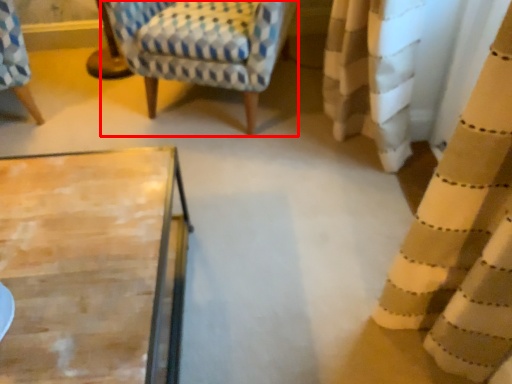
Question: From the image's perspective, where is rocking chair (annotated by the red box) located relative to curtain?

Choices:
 (A) above
 (B) below

Answer: (A)